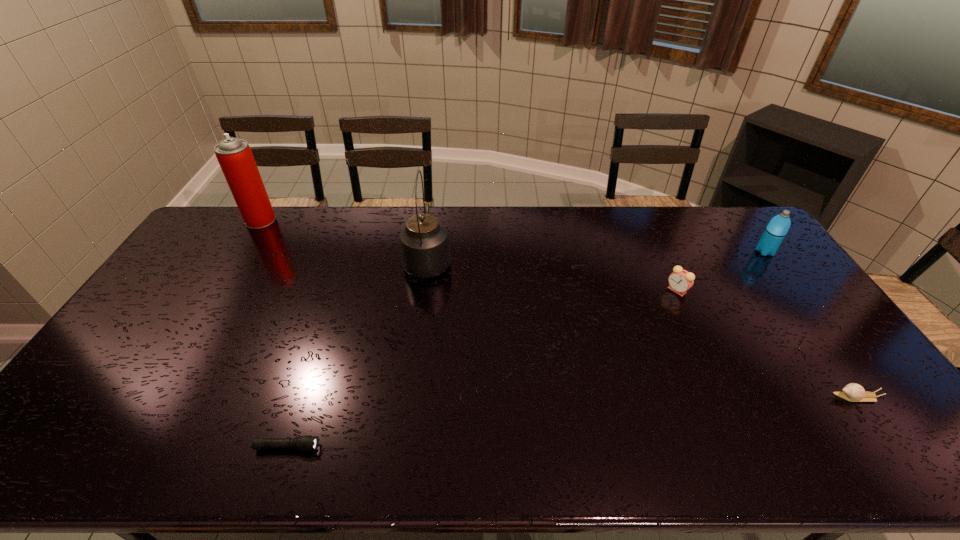
Locate an element on the screen. The image size is (960, 540). vacant space situated on the shell of the second nearest object is located at coordinates (722, 397).

The image size is (960, 540). Identify the location of free region located 0.240m at the lens end of the second object from left to right. click(421, 447).

At what (x,y) coordinates should I click in order to perform the action: click on aerosol can that is at the far edge. Please return your answer as a coordinate pair (x, y). This screenshot has width=960, height=540. Looking at the image, I should click on (234, 155).

At what (x,y) coordinates should I click in order to perform the action: click on kettle located at the far edge. Please return your answer as a coordinate pair (x, y). Looking at the image, I should click on (425, 253).

Locate an element on the screen. The width and height of the screenshot is (960, 540). object positioned at the near edge is located at coordinates 307,443.

Find the location of a particular element. The height and width of the screenshot is (540, 960). object present at the left edge is located at coordinates (234, 155).

Find the location of a particular element. thermos bottle that is positioned at the right edge is located at coordinates (779, 225).

Locate an element on the screen. escargot present at the right edge is located at coordinates (853, 392).

Where is `object at the far left corner`? object at the far left corner is located at coordinates (234, 155).

This screenshot has height=540, width=960. I want to click on vacant space at the far edge, so click(321, 230).